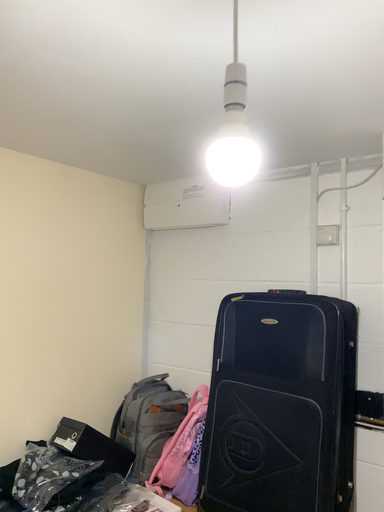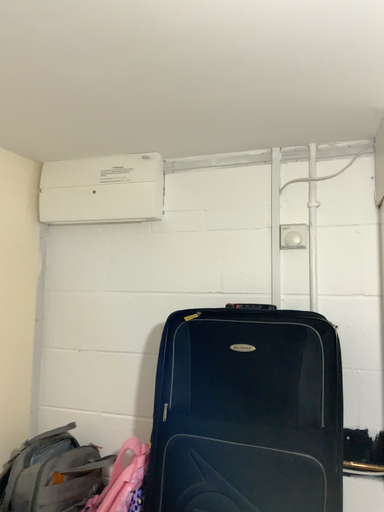
Question: How did the camera likely rotate when shooting the video?

Choices:
 (A) rotated left
 (B) rotated right

Answer: (B)